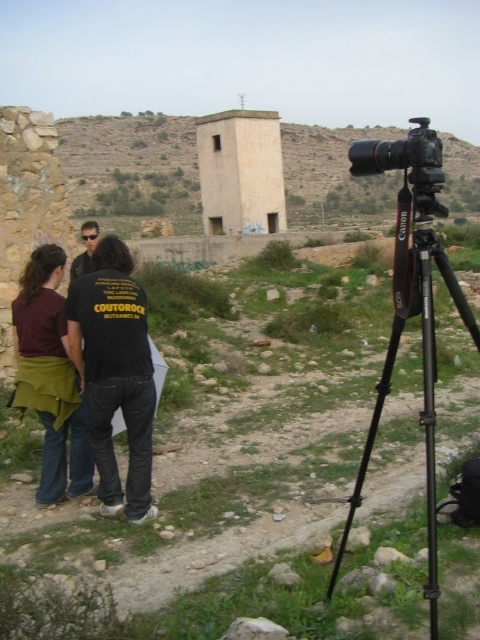
Question: Which point is closer to the camera?

Choices:
 (A) (74, 150)
 (B) (85, 264)
 (C) (39, 292)

Answer: (C)

Question: Can you confirm if black cotton shirt at center is positioned below black plastic camera at center?

Choices:
 (A) yes
 (B) no

Answer: (A)

Question: In this image, where is black plastic camera at center located relative to dark brown leather jacket at left?

Choices:
 (A) left
 (B) right

Answer: (B)

Question: Estimate the real-world distances between objects in this image. Which object is closer to the black metal tripod at right?

Choices:
 (A) black plastic camera at center
 (B) olive green fabric apron at center
 (C) brown rocky hill at upper center
 (D) dark brown leather jacket at left

Answer: (A)

Question: Is black metal tripod at right to the left of dark brown leather jacket at left from the viewer's perspective?

Choices:
 (A) no
 (B) yes

Answer: (A)

Question: Which point appears closest to the camera in this image?

Choices:
 (A) (73, 272)
 (B) (467, 317)
 (C) (359, 164)
 (D) (169, 170)

Answer: (B)